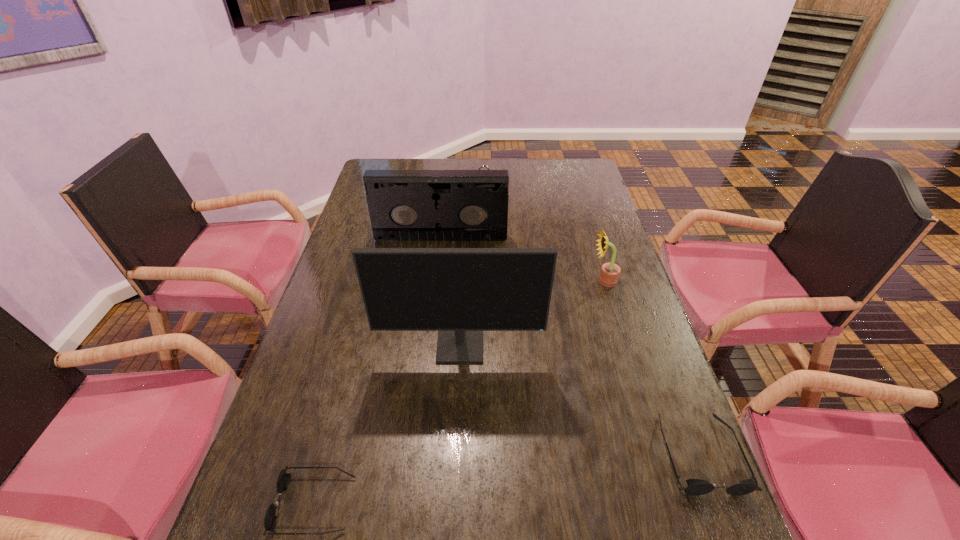
This screenshot has width=960, height=540. I want to click on videotape that is at the left edge, so click(404, 205).

Locate an element on the screen. This screenshot has height=540, width=960. sunglasses present at the right edge is located at coordinates (695, 487).

The height and width of the screenshot is (540, 960). Find the location of `sunflower that is positioned at the right edge`. sunflower that is positioned at the right edge is located at coordinates (x=610, y=272).

This screenshot has width=960, height=540. I want to click on object at the near left corner, so click(283, 480).

The width and height of the screenshot is (960, 540). What are the coordinates of `object at the near right corner` in the screenshot? It's located at (695, 487).

At what (x,y) coordinates should I click in order to perform the action: click on vacant space at the far edge of the desktop. Please return your answer as a coordinate pair (x, y). The width and height of the screenshot is (960, 540). Looking at the image, I should click on (539, 169).

This screenshot has width=960, height=540. Identify the location of free space at the left edge of the desktop. [x=350, y=240].

Where is `blank area at the right edge`? blank area at the right edge is located at coordinates 620,273.

This screenshot has height=540, width=960. In order to click on vacant space that's between the third farthest object and the taller sunglasses in this screenshot , I will do `click(652, 367)`.

You are a GUI agent. You are given a task and a screenshot of the screen. Output one action in this format:
    pyautogui.click(x=<x>, y=<y>)
    Task: Click on the free point between the second shortest object and the computer monitor
    This screenshot has height=540, width=960.
    Given the screenshot: What is the action you would take?
    pyautogui.click(x=580, y=400)